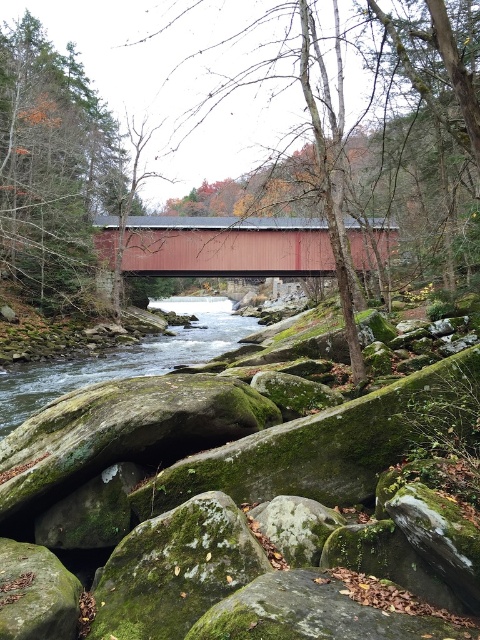
Question: Does matte red bridge at center come behind smooth bark tree at center?

Choices:
 (A) yes
 (B) no

Answer: (A)

Question: Can you confirm if green mossy rock at left is positioned above green mossy rock at lower left?

Choices:
 (A) no
 (B) yes

Answer: (B)

Question: Which object is farther from the camera taking this photo?

Choices:
 (A) green mossy rock at left
 (B) green mossy rock at lower left

Answer: (A)

Question: Which is farther from the smooth bark tree at center?

Choices:
 (A) green mossy rock at lower left
 (B) matte red bridge at center

Answer: (A)

Question: Which point is farther to the camera?

Choices:
 (A) green mossy rock at lower left
 (B) matte red bridge at center
 (C) green mossy rock at left
 (D) smooth bark tree at center

Answer: (C)

Question: Observing the image, what is the correct spatial positioning of green mossy rock at left in reference to matte red bridge at center?

Choices:
 (A) right
 (B) left

Answer: (B)